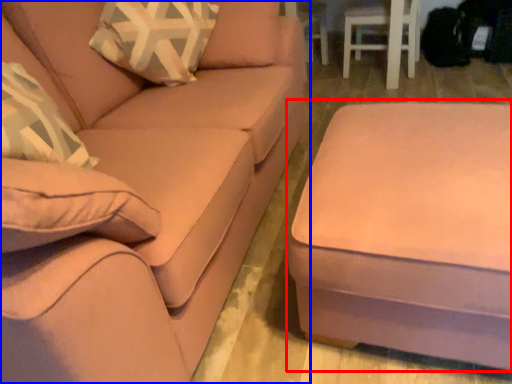
Question: Among these objects, which one is nearest to the camera, table (highlighted by a red box) or studio couch (highlighted by a blue box)?

Choices:
 (A) table
 (B) studio couch

Answer: (B)